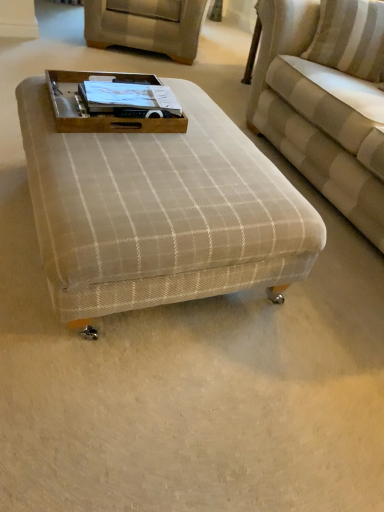
You are a GUI agent. You are given a task and a screenshot of the screen. Output one action in this format:
    pyautogui.click(x=<x>, y=<y>)
    Task: Click on the free space in front of brown wooden tray at center
    The image size is (384, 512).
    Given the screenshot: What is the action you would take?
    pyautogui.click(x=108, y=166)